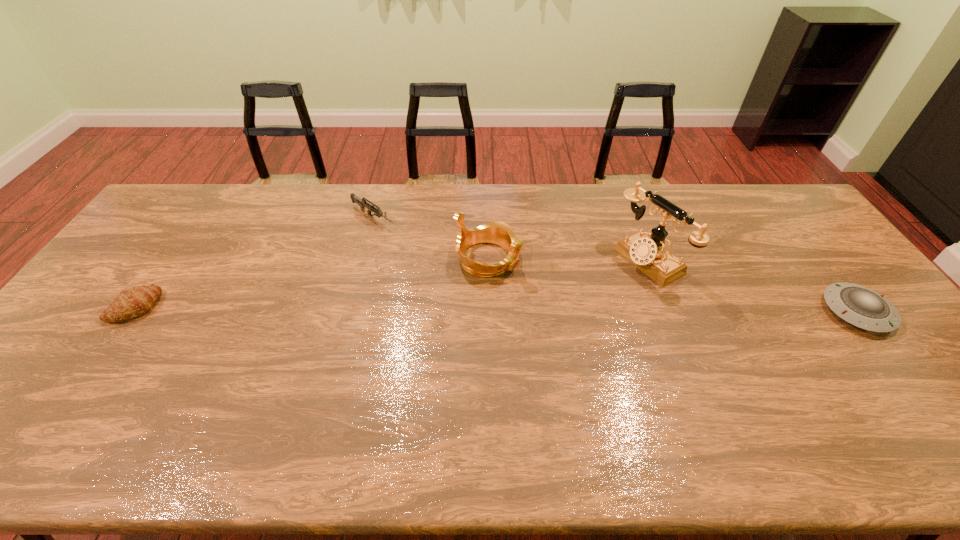
Where is `free space that satisfies the following two spatial constraints: 1. on the front side of the saucer; 2. on the right side of the gun`? The height and width of the screenshot is (540, 960). free space that satisfies the following two spatial constraints: 1. on the front side of the saucer; 2. on the right side of the gun is located at coordinates (348, 311).

The width and height of the screenshot is (960, 540). I want to click on vacant space that satisfies the following two spatial constraints: 1. on the front side of the second tallest object; 2. on the right side of the fourth object from left to right, so click(x=487, y=260).

Image resolution: width=960 pixels, height=540 pixels. Find the location of `vacant space that satisfies the following two spatial constraints: 1. on the front side of the fourth shortest object; 2. on the right side of the farthest object`. vacant space that satisfies the following two spatial constraints: 1. on the front side of the fourth shortest object; 2. on the right side of the farthest object is located at coordinates (362, 258).

Image resolution: width=960 pixels, height=540 pixels. Find the location of `free space that satisfies the following two spatial constraints: 1. on the front side of the rightmost object; 2. on the right side of the telephone`. free space that satisfies the following two spatial constraints: 1. on the front side of the rightmost object; 2. on the right side of the telephone is located at coordinates (668, 311).